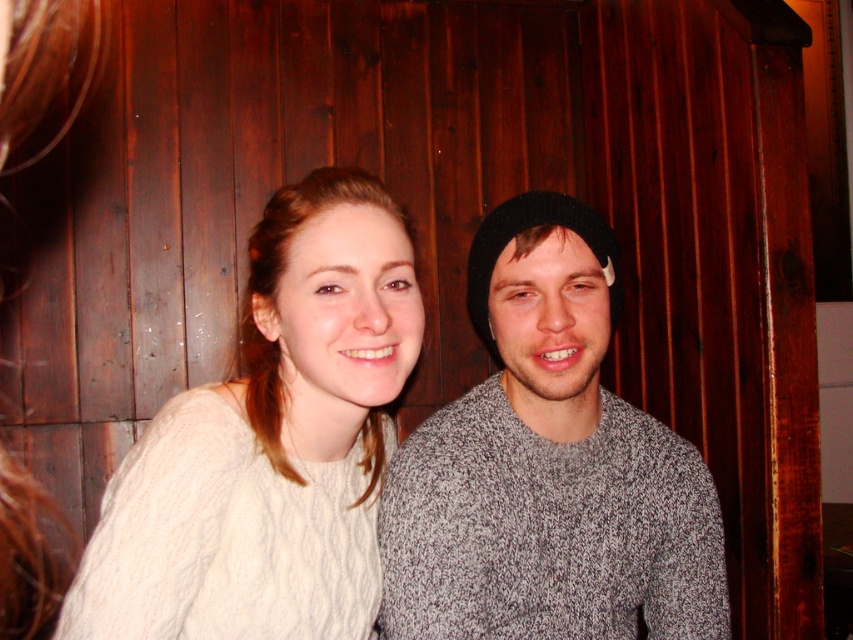
Question: Is white cable-knit sweater at center to the left of black knit beanie at center from the viewer's perspective?

Choices:
 (A) no
 (B) yes

Answer: (B)

Question: Which of the following is the farthest from the observer?

Choices:
 (A) white cable-knit sweater at center
 (B) knitted gray sweater at center

Answer: (B)

Question: Which object is positioned farthest from the white cable-knit sweater at center?

Choices:
 (A) black knit beanie at center
 (B) knitted gray sweater at center

Answer: (A)

Question: Among these points, which one is nearest to the camera?

Choices:
 (A) (677, 547)
 (B) (337, 253)
 (C) (517, 221)

Answer: (B)

Question: Is knitted gray sweater at center above black knit beanie at center?

Choices:
 (A) no
 (B) yes

Answer: (A)

Question: Considering the relative positions of knitted gray sweater at center and black knit beanie at center in the image provided, where is knitted gray sweater at center located with respect to black knit beanie at center?

Choices:
 (A) above
 (B) below

Answer: (B)